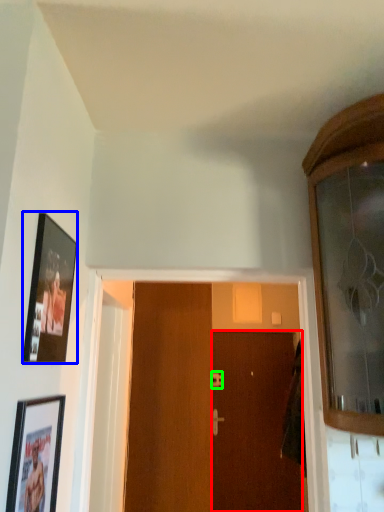
Question: Estimate the real-world distances between objects in this image. Which object is farther from door (highlighted by a red box), picture frame (highlighted by a blue box) or door handle (highlighted by a green box)?

Choices:
 (A) picture frame
 (B) door handle

Answer: (A)